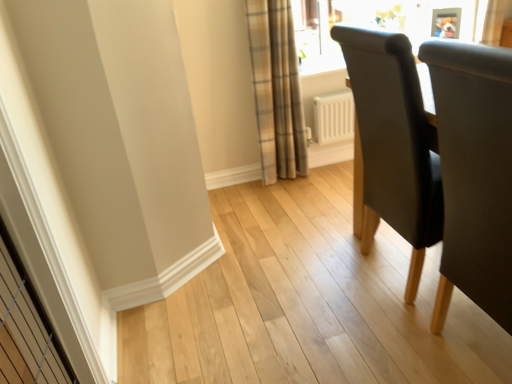
What is the approximate height of plaid fabric curtain at upper center?

plaid fabric curtain at upper center is 1.10 meters in height.

What do you see at coordinates (392, 145) in the screenshot?
I see `dark gray fabric chair at right, which is the 1th chair from back to front` at bounding box center [392, 145].

This screenshot has width=512, height=384. Describe the element at coordinates (474, 174) in the screenshot. I see `black leather chair at right, positioned as the second chair in back-to-front order` at that location.

Where is `plaid fabric curtain at upper center`? This screenshot has height=384, width=512. plaid fabric curtain at upper center is located at coordinates (276, 90).

Between point (295, 57) and point (505, 218), which one is positioned in front?

The point (505, 218) is more forward.

Is plaid fabric curtain at upper center next to black leather chair at right, positioned as the second chair in back-to-front order, and touching it?

No, plaid fabric curtain at upper center is not making contact with black leather chair at right, positioned as the second chair in back-to-front order.

In the scene shown: Who is more distant, plaid fabric curtain at upper center or black leather chair at right, positioned as the second chair in back-to-front order?

Positioned behind is plaid fabric curtain at upper center.

From a real-world perspective, is plaid fabric curtain at upper center positioned above or below black leather chair at right, positioned as the second chair in back-to-front order?

plaid fabric curtain at upper center is above black leather chair at right, positioned as the second chair in back-to-front order.

Is black leather chair at right, placed as the 1th chair when sorted from front to back, positioned before plaid fabric curtain at upper center?

Yes, the depth of black leather chair at right, placed as the 1th chair when sorted from front to back, is less than that of plaid fabric curtain at upper center.

Is black leather chair at right, positioned as the second chair in back-to-front order, facing towards plaid fabric curtain at upper center?

No, black leather chair at right, positioned as the second chair in back-to-front order, is not oriented towards plaid fabric curtain at upper center.

From their relative heights in the image, would you say black leather chair at right, placed as the 1th chair when sorted from front to back, is taller or shorter than plaid fabric curtain at upper center?

Considering their sizes, black leather chair at right, placed as the 1th chair when sorted from front to back, has less height than plaid fabric curtain at upper center.

At what (x,y) coordinates should I click in order to perform the action: click on the 2nd chair positioned below the plaid fabric curtain at upper center (from the image's perspective). Please return your answer as a coordinate pair (x, y). Looking at the image, I should click on (474, 174).

From the image's perspective, is black leather chair at right, positioned as the second chair in back-to-front order, positioned above or below dark gray fabric chair at right, the 2th chair viewed from the front?

black leather chair at right, positioned as the second chair in back-to-front order, is situated lower than dark gray fabric chair at right, the 2th chair viewed from the front, in the image.

From a real-world perspective, does black leather chair at right, placed as the 1th chair when sorted from front to back, sit lower than dark gray fabric chair at right, the 2th chair viewed from the front?

No, from a real-world perspective, black leather chair at right, placed as the 1th chair when sorted from front to back, is not under dark gray fabric chair at right, the 2th chair viewed from the front.

Would you say black leather chair at right, positioned as the second chair in back-to-front order, is to the left or to the right of dark gray fabric chair at right, which is the 1th chair from back to front, in the picture?

black leather chair at right, positioned as the second chair in back-to-front order, is to the right of dark gray fabric chair at right, which is the 1th chair from back to front.

Does black leather chair at right, placed as the 1th chair when sorted from front to back, have a lesser height compared to dark gray fabric chair at right, which is the 1th chair from back to front?

Yes, black leather chair at right, placed as the 1th chair when sorted from front to back, is shorter than dark gray fabric chair at right, which is the 1th chair from back to front.

Between dark gray fabric chair at right, which is the 1th chair from back to front, and plaid fabric curtain at upper center, which one has less height?

Standing shorter between the two is dark gray fabric chair at right, which is the 1th chair from back to front.

From the image's perspective, is dark gray fabric chair at right, the 2th chair viewed from the front, over plaid fabric curtain at upper center?

No.

How different are the orientations of dark gray fabric chair at right, the 2th chair viewed from the front, and plaid fabric curtain at upper center in degrees?

The angular difference between dark gray fabric chair at right, the 2th chair viewed from the front, and plaid fabric curtain at upper center is 87 degrees.

Is dark gray fabric chair at right, which is the 1th chair from back to front, far away from plaid fabric curtain at upper center?

Yes, dark gray fabric chair at right, which is the 1th chair from back to front, is far from plaid fabric curtain at upper center.

The height and width of the screenshot is (384, 512). Find the location of `chair that is in front of the dark gray fabric chair at right, the 2th chair viewed from the front`. chair that is in front of the dark gray fabric chair at right, the 2th chair viewed from the front is located at coordinates (474, 174).

Is black leather chair at right, positioned as the second chair in back-to-front order, inside dark gray fabric chair at right, which is the 1th chair from back to front?

No, black leather chair at right, positioned as the second chair in back-to-front order, is not surrounded by dark gray fabric chair at right, which is the 1th chair from back to front.

Is dark gray fabric chair at right, which is the 1th chair from back to front, positioned far away from black leather chair at right, placed as the 1th chair when sorted from front to back?

No, there isn't a large distance between dark gray fabric chair at right, which is the 1th chair from back to front, and black leather chair at right, placed as the 1th chair when sorted from front to back.

Is dark gray fabric chair at right, which is the 1th chair from back to front, positioned in front of black leather chair at right, positioned as the second chair in back-to-front order?

No, it is behind black leather chair at right, positioned as the second chair in back-to-front order.

Is plaid fabric curtain at upper center facing towards dark gray fabric chair at right, the 2th chair viewed from the front?

Yes.

Can you confirm if plaid fabric curtain at upper center is smaller than dark gray fabric chair at right, the 2th chair viewed from the front?

Indeed, plaid fabric curtain at upper center has a smaller size compared to dark gray fabric chair at right, the 2th chair viewed from the front.

From the image's perspective, which is below, plaid fabric curtain at upper center or dark gray fabric chair at right, which is the 1th chair from back to front?

dark gray fabric chair at right, which is the 1th chair from back to front, appears lower in the image.

This screenshot has height=384, width=512. Identify the location of curtain that appears behind the black leather chair at right, positioned as the second chair in back-to-front order. (276, 90).

The image size is (512, 384). I want to click on the 1st chair directly beneath the plaid fabric curtain at upper center (from a real-world perspective), so click(474, 174).

Considering their positions, is black leather chair at right, positioned as the second chair in back-to-front order, positioned closer to dark gray fabric chair at right, which is the 1th chair from back to front, than plaid fabric curtain at upper center?

A: Among the two, black leather chair at right, positioned as the second chair in back-to-front order, is located nearer to dark gray fabric chair at right, which is the 1th chair from back to front.

Looking at the image, which one is located further to dark gray fabric chair at right, the 2th chair viewed from the front, plaid fabric curtain at upper center or black leather chair at right, placed as the 1th chair when sorted from front to back?

Based on the image, plaid fabric curtain at upper center appears to be further to dark gray fabric chair at right, the 2th chair viewed from the front.

Based on their spatial positions, is dark gray fabric chair at right, the 2th chair viewed from the front, or plaid fabric curtain at upper center further from black leather chair at right, placed as the 1th chair when sorted from front to back?

Based on the image, plaid fabric curtain at upper center appears to be further to black leather chair at right, placed as the 1th chair when sorted from front to back.

From the image, which object appears to be farther from black leather chair at right, positioned as the second chair in back-to-front order, plaid fabric curtain at upper center or dark gray fabric chair at right, the 2th chair viewed from the front?

plaid fabric curtain at upper center lies further to black leather chair at right, positioned as the second chair in back-to-front order, than the other object.

When comparing their distances from plaid fabric curtain at upper center, does black leather chair at right, placed as the 1th chair when sorted from front to back, or dark gray fabric chair at right, the 2th chair viewed from the front, seem closer?

dark gray fabric chair at right, the 2th chair viewed from the front.

Which object lies further to the anchor point plaid fabric curtain at upper center, dark gray fabric chair at right, the 2th chair viewed from the front, or black leather chair at right, placed as the 1th chair when sorted from front to back?

black leather chair at right, placed as the 1th chair when sorted from front to back, lies further to plaid fabric curtain at upper center than the other object.

The image size is (512, 384). I want to click on chair between black leather chair at right, placed as the 1th chair when sorted from front to back, and plaid fabric curtain at upper center, along the z-axis, so click(x=392, y=145).